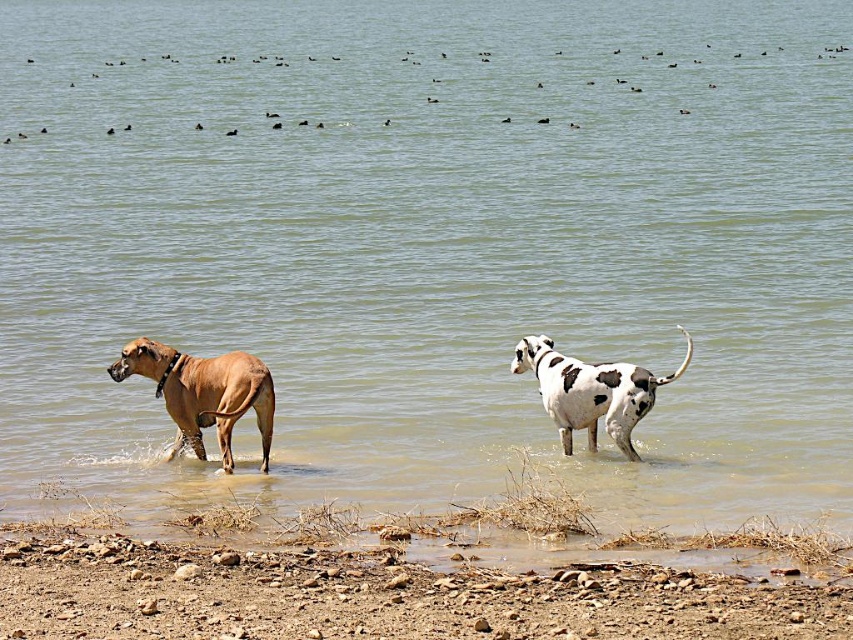
Based on the photo, does brown smooth coat dog at left appear over white spotted fur dog at center?

No, brown smooth coat dog at left is not above white spotted fur dog at center.

Is brown smooth coat dog at left positioned behind white spotted fur dog at center?

No, brown smooth coat dog at left is closer to the viewer.

Is point (231, 403) closer to viewer compared to point (520, 348)?

Yes, point (231, 403) is closer to viewer.

Identify the location of brown smooth coat dog at left. Image resolution: width=853 pixels, height=640 pixels. (202, 392).

Can you confirm if dried mud at lower center is smaller than white spotted fur dog at center?

Actually, dried mud at lower center might be larger than white spotted fur dog at center.

Where is `dried mud at lower center`? dried mud at lower center is located at coordinates (x=378, y=595).

This screenshot has width=853, height=640. I want to click on dried mud at lower center, so click(378, 595).

Can you confirm if dried mud at lower center is positioned to the left of brown smooth coat dog at left?

Incorrect, dried mud at lower center is not on the left side of brown smooth coat dog at left.

Can you confirm if dried mud at lower center is positioned above brown smooth coat dog at left?

No, dried mud at lower center is not above brown smooth coat dog at left.

Locate an element on the screen. This screenshot has width=853, height=640. dried mud at lower center is located at coordinates coord(378,595).